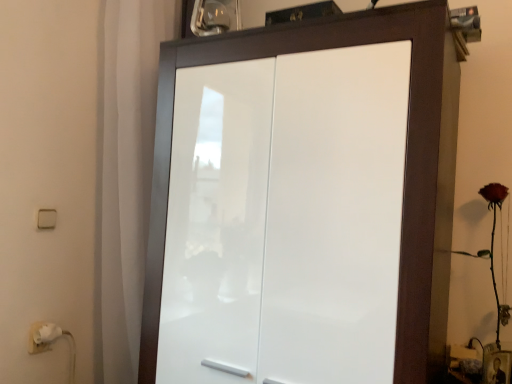
Question: Considering the relative sizes of white glossy cupboard at center and white plastic light switch at left in the image provided, is white glossy cupboard at center taller than white plastic light switch at left?

Choices:
 (A) yes
 (B) no

Answer: (A)

Question: Considering the relative sizes of white glossy cupboard at center and white plastic light switch at left in the image provided, is white glossy cupboard at center wider than white plastic light switch at left?

Choices:
 (A) yes
 (B) no

Answer: (A)

Question: Is the depth of white glossy cupboard at center less than that of white plastic light switch at left?

Choices:
 (A) no
 (B) yes

Answer: (B)

Question: Does white glossy cupboard at center appear on the right side of white plastic light switch at left?

Choices:
 (A) no
 (B) yes

Answer: (B)

Question: From the image's perspective, is white glossy cupboard at center located beneath white plastic light switch at left?

Choices:
 (A) no
 (B) yes

Answer: (B)

Question: In terms of size, does white glossy cupboard at center appear bigger or smaller than matte red rose at right?

Choices:
 (A) small
 (B) big

Answer: (B)

Question: From the image's perspective, relative to matte red rose at right, is white glossy cupboard at center above or below?

Choices:
 (A) above
 (B) below

Answer: (A)

Question: In the image, is white glossy cupboard at center positioned in front of or behind matte red rose at right?

Choices:
 (A) behind
 (B) front

Answer: (B)

Question: From a real-world perspective, is white glossy cupboard at center positioned above or below matte red rose at right?

Choices:
 (A) below
 (B) above

Answer: (B)

Question: Does point (508, 314) appear closer or farther from the camera than point (55, 210)?

Choices:
 (A) closer
 (B) farther

Answer: (A)

Question: Considering the positions of matte red rose at right and white plastic light switch at left in the image, is matte red rose at right wider or thinner than white plastic light switch at left?

Choices:
 (A) thin
 (B) wide

Answer: (B)

Question: Would you say matte red rose at right is inside or outside white plastic light switch at left?

Choices:
 (A) inside
 (B) outside

Answer: (B)

Question: From their relative heights in the image, would you say matte red rose at right is taller or shorter than white plastic light switch at left?

Choices:
 (A) short
 (B) tall

Answer: (B)

Question: In terms of width, does white plastic light switch at left look wider or thinner when compared to white glossy cupboard at center?

Choices:
 (A) thin
 (B) wide

Answer: (A)

Question: Is white plastic light switch at left to the left or to the right of white glossy cupboard at center in the image?

Choices:
 (A) left
 (B) right

Answer: (A)